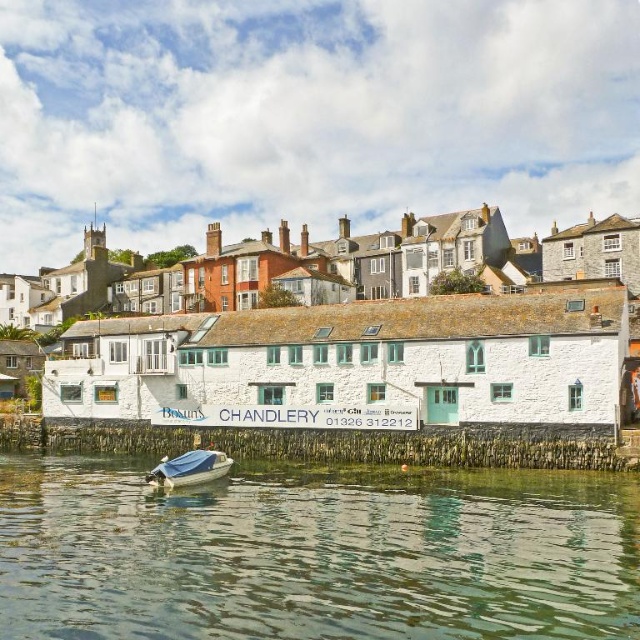
Describe the element at coordinates (314, 554) in the screenshot. Image resolution: width=640 pixels, height=640 pixels. I see `greenish water at lower center` at that location.

Is greenish water at lower center wider than blue tarpaulin boat at lower center?

→ Yes.

Find the location of `greenish water at lower center`. greenish water at lower center is located at coordinates [314, 554].

Does greenish water at lower center have a smaller size compared to white stone building at center?

Yes.

Is greenish water at lower center closer to the viewer compared to white stone building at center?

Yes, it is.

Between point (349, 544) and point (464, 410), which one is positioned in front?

Positioned in front is point (349, 544).

This screenshot has width=640, height=640. Find the location of `greenish water at lower center`. greenish water at lower center is located at coordinates (314, 554).

Which is more to the right, white stone building at center or blue tarpaulin boat at lower center?

From the viewer's perspective, white stone building at center appears more on the right side.

Is white stone building at center to the left of blue tarpaulin boat at lower center from the viewer's perspective?

Incorrect, white stone building at center is not on the left side of blue tarpaulin boat at lower center.

Who is more distant from viewer, (260, 380) or (212, 480)?

Positioned behind is point (260, 380).

Where is `white stone building at center`? white stone building at center is located at coordinates (353, 362).